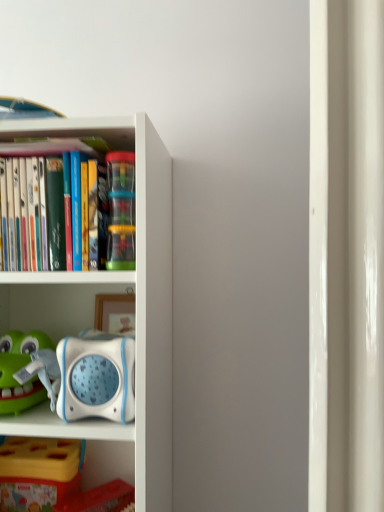
Question: Would you say translucent plastic cups at center is outside yellow plastic toy at lower left?

Choices:
 (A) yes
 (B) no

Answer: (A)

Question: Can you confirm if translucent plastic cups at center is bigger than yellow plastic toy at lower left?

Choices:
 (A) no
 (B) yes

Answer: (A)

Question: From a real-world perspective, is translucent plastic cups at center under yellow plastic toy at lower left?

Choices:
 (A) no
 (B) yes

Answer: (A)

Question: Is translucent plastic cups at center behind yellow plastic toy at lower left?

Choices:
 (A) yes
 (B) no

Answer: (B)

Question: Is yellow plastic toy at lower left inside translucent plastic cups at center?

Choices:
 (A) no
 (B) yes

Answer: (A)

Question: Relative to yellow plastic toy at lower left, is white plastic bookcase at left in front or behind?

Choices:
 (A) front
 (B) behind

Answer: (A)

Question: Looking at the image, does white plastic bookcase at left seem bigger or smaller compared to yellow plastic toy at lower left?

Choices:
 (A) small
 (B) big

Answer: (B)

Question: Is white plastic bookcase at left wider or thinner than yellow plastic toy at lower left?

Choices:
 (A) thin
 (B) wide

Answer: (B)

Question: Would you say white plastic bookcase at left is inside or outside yellow plastic toy at lower left?

Choices:
 (A) outside
 (B) inside

Answer: (A)

Question: Looking at their shapes, would you say translucent plastic cups at center is wider or thinner than white plastic bookcase at left?

Choices:
 (A) wide
 (B) thin

Answer: (B)

Question: Is translucent plastic cups at center in front of or behind white plastic bookcase at left in the image?

Choices:
 (A) front
 (B) behind

Answer: (B)

Question: From a real-world perspective, is translucent plastic cups at center physically located above or below white plastic bookcase at left?

Choices:
 (A) below
 (B) above

Answer: (B)

Question: Is translucent plastic cups at center taller or shorter than white plastic bookcase at left?

Choices:
 (A) tall
 (B) short

Answer: (B)

Question: Considering their positions, is translucent plastic cups at center located in front of or behind yellow plastic toy at lower left?

Choices:
 (A) front
 (B) behind

Answer: (A)

Question: From a real-world perspective, is translucent plastic cups at center positioned above or below yellow plastic toy at lower left?

Choices:
 (A) above
 (B) below

Answer: (A)